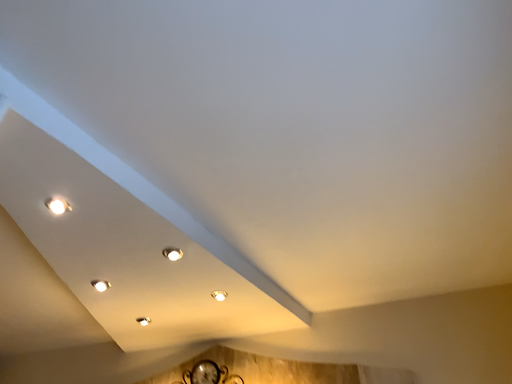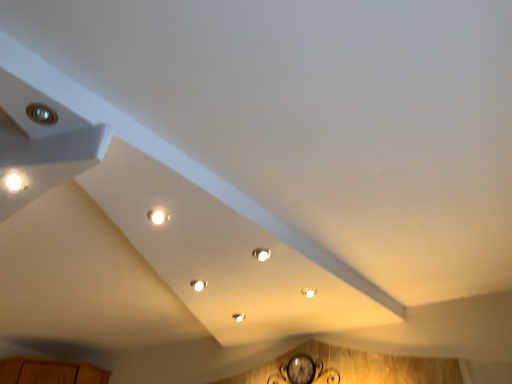
Question: Which way did the camera rotate in the video?

Choices:
 (A) rotated right
 (B) rotated left

Answer: (B)